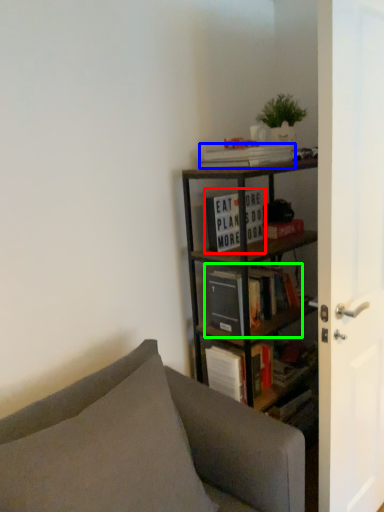
Question: Which is farther away from book (highlighted by a red box)? book (highlighted by a blue box) or book (highlighted by a green box)?

Choices:
 (A) book
 (B) book

Answer: (B)